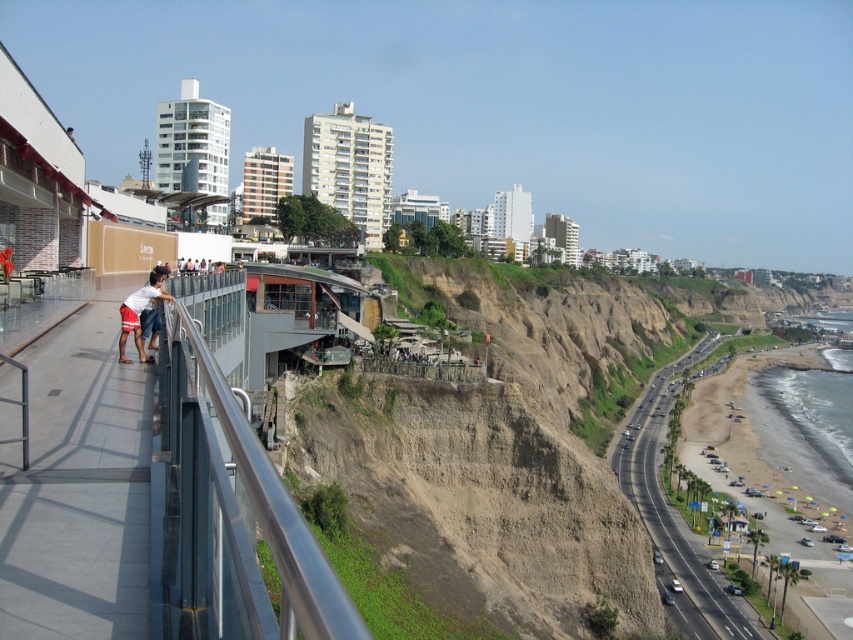
Does smooth concrete walkway at left have a larger size compared to transparent glass railing at left?

No.

Where is `smooth concrete walkway at left`? smooth concrete walkway at left is located at coordinates (78, 488).

Image resolution: width=853 pixels, height=640 pixels. What do you see at coordinates (78, 488) in the screenshot?
I see `smooth concrete walkway at left` at bounding box center [78, 488].

Can you confirm if smooth concrete walkway at left is taller than asphalt road at lower right?

Incorrect, smooth concrete walkway at left's height is not larger of asphalt road at lower right's.

Does point (96, 522) come farther from viewer compared to point (688, 618)?

No, it is in front of (688, 618).

This screenshot has height=640, width=853. Find the location of `smooth concrete walkway at left`. smooth concrete walkway at left is located at coordinates (78, 488).

Who is shorter, transparent glass railing at left or matte white shorts at left?

Standing shorter between the two is matte white shorts at left.

How much distance is there between transparent glass railing at left and matte white shorts at left?

transparent glass railing at left and matte white shorts at left are 62.74 feet apart.

Describe the element at coordinates (230, 516) in the screenshot. I see `transparent glass railing at left` at that location.

I want to click on transparent glass railing at left, so click(230, 516).